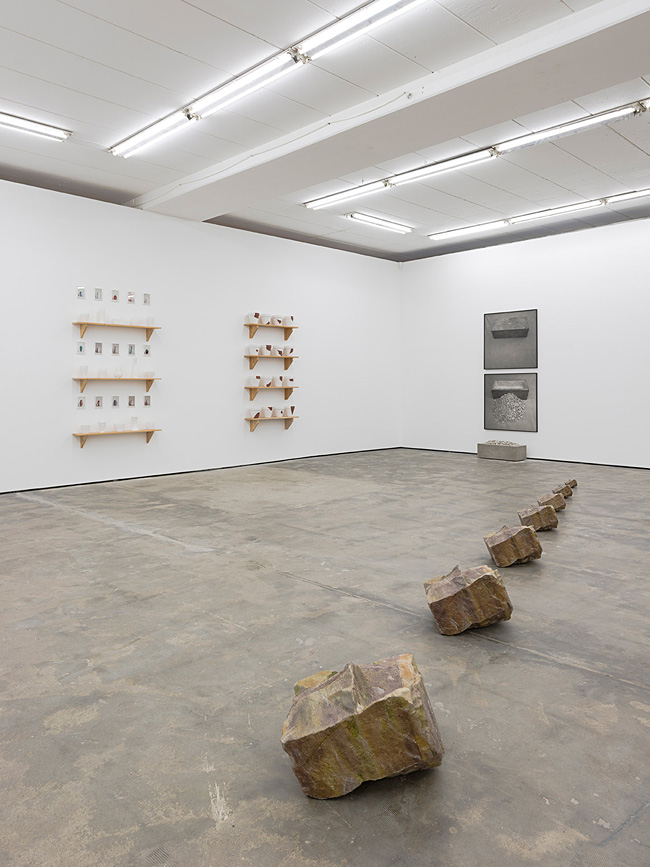
Identify the location of walls. This screenshot has height=867, width=650. (617, 386), (424, 356), (361, 351), (186, 372).